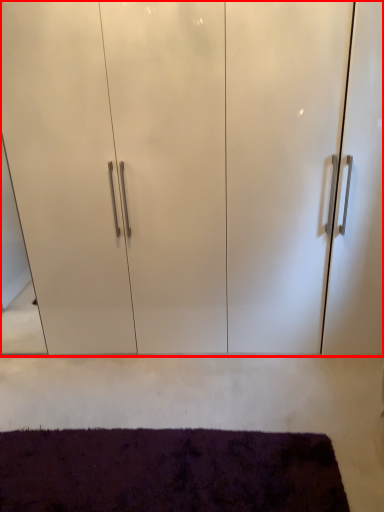
Question: Considering the relative positions of cupboard (annotated by the red box) and mat in the image provided, where is cupboard (annotated by the red box) located with respect to the staircase?

Choices:
 (A) right
 (B) left

Answer: (A)